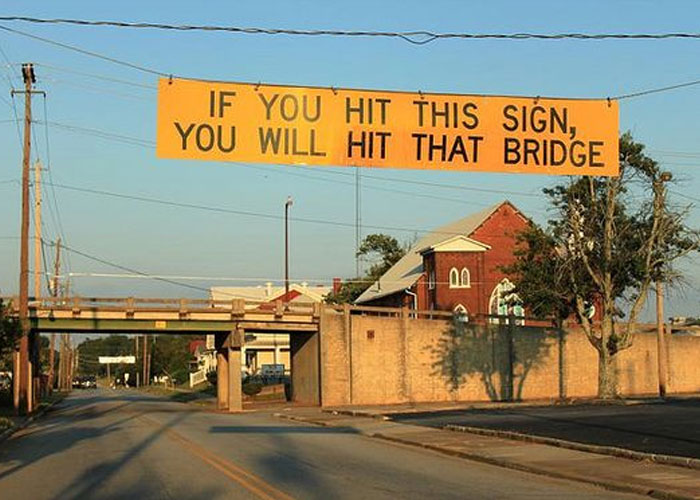
Locate an element on the screen. The height and width of the screenshot is (500, 700). pillar is located at coordinates (237, 375).